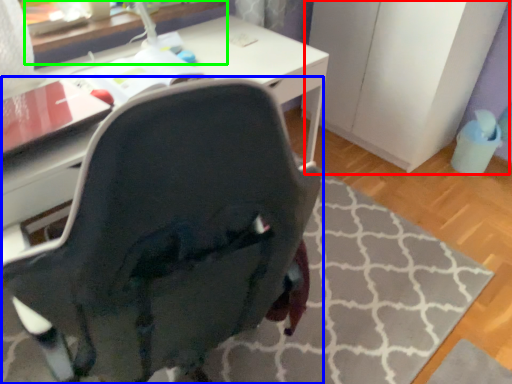
Question: Based on their relative distances, which object is farther from file cabinet (highlighted by a red box)? Choose from chair (highlighted by a blue box) and table (highlighted by a green box).

Choices:
 (A) chair
 (B) table

Answer: (A)